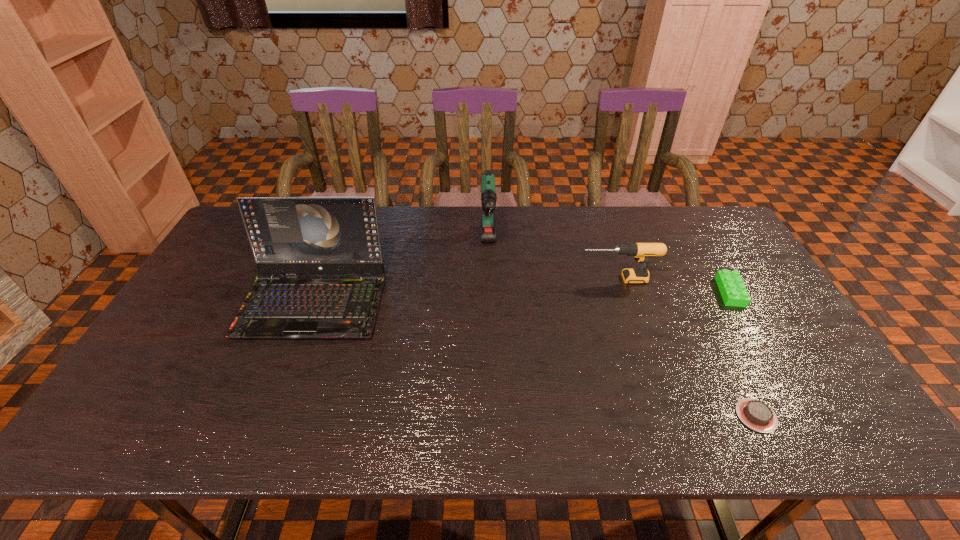
Locate an element on the screen. This screenshot has height=540, width=960. free spot located 0.330m on the handle side of the left drill is located at coordinates (491, 360).

Locate an element on the screen. free space located 0.360m on the handle side of the shorter drill is located at coordinates (462, 279).

You are a GUI agent. You are given a task and a screenshot of the screen. Output one action in this format:
    pyautogui.click(x=<x>, y=<y>)
    Task: Click on the vacant space situated on the handle side of the shorter drill
    Image resolution: width=960 pixels, height=540 pixels.
    Given the screenshot: What is the action you would take?
    pyautogui.click(x=560, y=279)

Locate an element on the screen. free space located 0.160m on the handle side of the shorter drill is located at coordinates coord(527,279).

This screenshot has width=960, height=540. Identify the location of free space located 0.110m on the left of the rightmost object. (681, 292).

The image size is (960, 540). Identify the location of free space located on the left of the nearest object. (585, 415).

Locate an element on the screen. The width and height of the screenshot is (960, 540). object located at the far edge is located at coordinates (488, 197).

Find the location of a particular element. object that is positioned at the near edge is located at coordinates (755, 414).

Locate an element on the screen. This screenshot has width=960, height=540. object at the right edge is located at coordinates (733, 291).

Where is `blank area at the far edge`? Image resolution: width=960 pixels, height=540 pixels. blank area at the far edge is located at coordinates (583, 246).